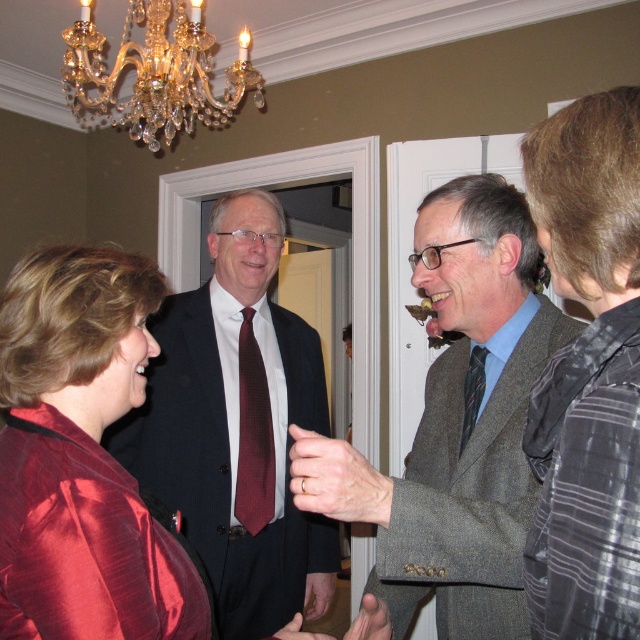
What do you see at coordinates (588, 372) in the screenshot? Image resolution: width=640 pixels, height=640 pixels. I see `gray striped shirt at right` at bounding box center [588, 372].

The image size is (640, 640). In order to click on gray striped shirt at right in this screenshot , I will do `click(588, 372)`.

Is shiny red blouse at lower left closer to the viewer compared to maroon textured tie at center?

Yes, shiny red blouse at lower left is in front of maroon textured tie at center.

Between point (147, 298) and point (268, 422), which one is positioned in front?

Point (147, 298) is more forward.

Which is behind, point (124, 348) or point (241, 452)?

The point (241, 452) is behind.

Where is `shiny red blouse at lower left`? The width and height of the screenshot is (640, 640). shiny red blouse at lower left is located at coordinates (81, 458).

Is textured brown suit at center below shiny red blouse at lower left?

Incorrect, textured brown suit at center is not positioned below shiny red blouse at lower left.

Is the position of textured brown suit at center less distant than that of shiny red blouse at lower left?

No, textured brown suit at center is further to the viewer.

Based on the photo, who is more distant from viewer, (x=417, y=483) or (x=109, y=461)?

Positioned behind is point (x=417, y=483).

The image size is (640, 640). Identify the location of textured brown suit at center. (456, 424).